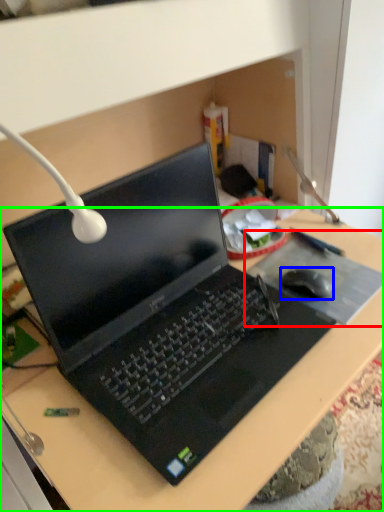
Question: Which object is positioned farthest from mousepad (highlighted by a red box)? Select from mouse (highlighted by a blue box) and desk (highlighted by a green box).

Choices:
 (A) mouse
 (B) desk

Answer: (B)